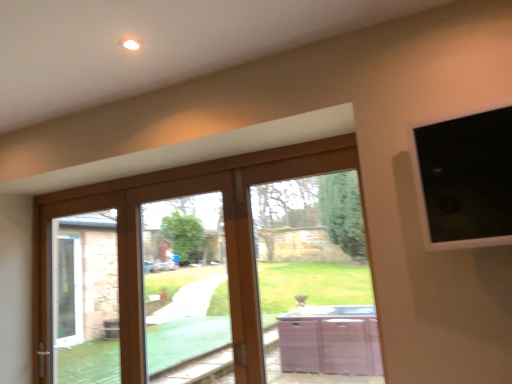
Describe the element at coordinates (184, 280) in the screenshot. I see `clear glass door at center` at that location.

Find the location of a particular element. This screenshot has height=384, width=512. wooden glass door at center is located at coordinates (211, 273).

Find the location of a particular element. Image resolution: width=512 pixels, height=384 pixels. clear glass door at center is located at coordinates (184, 280).

Considering the positions of objects black glass at upper right and clear glass door at center in the image provided, who is more to the right, black glass at upper right or clear glass door at center?

black glass at upper right.

Who is smaller, black glass at upper right or clear glass door at center?

black glass at upper right.

This screenshot has width=512, height=384. Identify the location of window behind the black glass at upper right. (184, 280).

From the image's perspective, is black glass at upper right under clear glass door at center?

Incorrect, from the image's perspective, black glass at upper right is higher than clear glass door at center.

Is clear glass door at center not inside brown wooden bay window at center?

Yes, clear glass door at center is located beyond the bounds of brown wooden bay window at center.

Can you tell me how much clear glass door at center and brown wooden bay window at center differ in facing direction?

The facing directions of clear glass door at center and brown wooden bay window at center are 0.517 degrees apart.

Is clear glass door at center behind brown wooden bay window at center?

Yes, it is behind brown wooden bay window at center.

Which of these two, clear glass door at center or brown wooden bay window at center, is smaller?

Smaller between the two is clear glass door at center.

Can you confirm if brown wooden bay window at center is shorter than black glass at upper right?

In fact, brown wooden bay window at center may be taller than black glass at upper right.

Consider the image. Can black glass at upper right be found inside brown wooden bay window at center?

Definitely not — black glass at upper right is not inside brown wooden bay window at center.

Measure the distance from brown wooden bay window at center to black glass at upper right.

A distance of 1.34 meters exists between brown wooden bay window at center and black glass at upper right.

How different are the orientations of brown wooden bay window at center and black glass at upper right in degrees?

8.83 degrees separate the facing orientations of brown wooden bay window at center and black glass at upper right.

The image size is (512, 384). In the image, there is a black glass at upper right. Find the location of `door below it (from the image's perspective)`. door below it (from the image's perspective) is located at coordinates point(211,273).

Is wooden glass door at center facing away from black glass at upper right?

wooden glass door at center is not turned away from black glass at upper right.

Who is taller, wooden glass door at center or black glass at upper right?

Standing taller between the two is wooden glass door at center.

Is the position of wooden glass door at center more distant than that of black glass at upper right?

Yes, wooden glass door at center is further from the viewer.

Is brown wooden bay window at center oriented away from clear glass door at center?

brown wooden bay window at center is not turned away from clear glass door at center.

Between brown wooden bay window at center and clear glass door at center, which one has less height?

brown wooden bay window at center is shorter.

From the image's perspective, is brown wooden bay window at center above clear glass door at center?

Yes.

Image resolution: width=512 pixels, height=384 pixels. Find the location of `window that is under the brown wooden bay window at center (from a real-world perspective)`. window that is under the brown wooden bay window at center (from a real-world perspective) is located at coordinates (184, 280).

Is wooden glass door at center at the back of black glass at upper right?

black glass at upper right is not turned away from wooden glass door at center.

Is black glass at upper right positioned far away from wooden glass door at center?

Yes, black glass at upper right and wooden glass door at center are quite far apart.

Which of these two, black glass at upper right or wooden glass door at center, is wider?

wooden glass door at center.

Considering the relative positions of black glass at upper right and wooden glass door at center in the image provided, is black glass at upper right behind wooden glass door at center?

That is False.

The width and height of the screenshot is (512, 384). Find the location of `door below the brown wooden bay window at center (from the image's perspective)`. door below the brown wooden bay window at center (from the image's perspective) is located at coordinates (211, 273).

Is brown wooden bay window at center further to the viewer compared to wooden glass door at center?

Yes, brown wooden bay window at center is further from the viewer.

How many degrees apart are the facing directions of brown wooden bay window at center and wooden glass door at center?

0.672 degrees separate the facing orientations of brown wooden bay window at center and wooden glass door at center.

There is a clear glass door at center. Where is `window screen above it (from a real-world perspective)`? window screen above it (from a real-world perspective) is located at coordinates (466, 179).

Locate an element on the screen. window behind the brown wooden bay window at center is located at coordinates (184, 280).

Looking at the image, which one is located closer to clear glass door at center, wooden glass door at center or black glass at upper right?

The object closer to clear glass door at center is wooden glass door at center.

Which object lies further to the anchor point clear glass door at center, wooden glass door at center or brown wooden bay window at center?

brown wooden bay window at center is further to clear glass door at center.

From the image, which object appears to be nearer to black glass at upper right, brown wooden bay window at center or wooden glass door at center?

brown wooden bay window at center is positioned closer to the anchor black glass at upper right.

Looking at the image, which one is located further to wooden glass door at center, clear glass door at center or black glass at upper right?

black glass at upper right lies further to wooden glass door at center than the other object.

Considering their positions, is brown wooden bay window at center positioned closer to clear glass door at center than black glass at upper right?

Based on the image, brown wooden bay window at center appears to be nearer to clear glass door at center.

From the image, which object appears to be farther from black glass at upper right, wooden glass door at center or clear glass door at center?

clear glass door at center lies further to black glass at upper right than the other object.

When comparing their distances from brown wooden bay window at center, does wooden glass door at center or clear glass door at center seem closer?

A: wooden glass door at center is positioned closer to the anchor brown wooden bay window at center.

Based on their spatial positions, is wooden glass door at center or brown wooden bay window at center further from black glass at upper right?

wooden glass door at center lies further to black glass at upper right than the other object.

Locate an element on the screen. The height and width of the screenshot is (384, 512). window between wooden glass door at center and brown wooden bay window at center from left to right is located at coordinates (184, 280).

The image size is (512, 384). I want to click on window located between wooden glass door at center and black glass at upper right in the left-right direction, so point(184,280).

This screenshot has height=384, width=512. Identify the location of bay window between wooden glass door at center and black glass at upper right. [x=316, y=276].

Find the location of `bay window between clear glass door at center and black glass at upper right from left to right`. bay window between clear glass door at center and black glass at upper right from left to right is located at coordinates (316, 276).